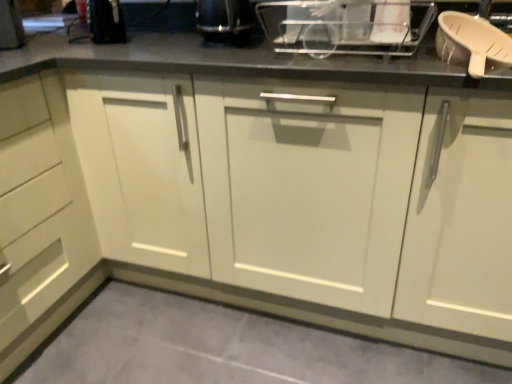
Question: Can you confirm if black plastic kettle at upper center, acting as the 1th appliance starting from the left, is bigger than gray tile floor at lower center?

Choices:
 (A) yes
 (B) no

Answer: (B)

Question: Does black plastic kettle at upper center, acting as the 1th appliance starting from the left, have a lesser height compared to gray tile floor at lower center?

Choices:
 (A) no
 (B) yes

Answer: (A)

Question: Is black plastic kettle at upper center, which appears as the 2th appliance when viewed from the right, with gray tile floor at lower center?

Choices:
 (A) no
 (B) yes

Answer: (A)

Question: Is the position of black plastic kettle at upper center, acting as the 1th appliance starting from the left, less distant than that of gray tile floor at lower center?

Choices:
 (A) yes
 (B) no

Answer: (B)

Question: Is black plastic kettle at upper center, acting as the 1th appliance starting from the left, surrounding gray tile floor at lower center?

Choices:
 (A) yes
 (B) no

Answer: (B)

Question: Considering the positions of gray tile floor at lower center and black plastic kettle at upper center, acting as the 1th appliance starting from the left, in the image, is gray tile floor at lower center wider or thinner than black plastic kettle at upper center, acting as the 1th appliance starting from the left,?

Choices:
 (A) thin
 (B) wide

Answer: (B)

Question: From the image's perspective, is gray tile floor at lower center positioned above or below black plastic kettle at upper center, acting as the 1th appliance starting from the left?

Choices:
 (A) below
 (B) above

Answer: (A)

Question: From a real-world perspective, is gray tile floor at lower center physically located above or below black plastic kettle at upper center, which appears as the 2th appliance when viewed from the right?

Choices:
 (A) above
 (B) below

Answer: (B)

Question: Relative to black plastic kettle at upper center, acting as the 1th appliance starting from the left, is gray tile floor at lower center in front or behind?

Choices:
 (A) front
 (B) behind

Answer: (A)

Question: Looking at their shapes, would you say white plastic dish rack at upper center, the second appliance viewed from the left, is wider or thinner than black plastic kettle at upper center, which appears as the 2th appliance when viewed from the right?

Choices:
 (A) wide
 (B) thin

Answer: (A)

Question: Based on their sizes in the image, would you say white plastic dish rack at upper center, which appears as the first appliance when viewed from the right, is bigger or smaller than black plastic kettle at upper center, acting as the 1th appliance starting from the left?

Choices:
 (A) big
 (B) small

Answer: (B)

Question: From a real-world perspective, is white plastic dish rack at upper center, which appears as the first appliance when viewed from the right, physically located above or below black plastic kettle at upper center, acting as the 1th appliance starting from the left?

Choices:
 (A) below
 (B) above

Answer: (B)

Question: Considering the relative positions of white plastic dish rack at upper center, which appears as the first appliance when viewed from the right, and black plastic kettle at upper center, acting as the 1th appliance starting from the left, in the image provided, is white plastic dish rack at upper center, which appears as the first appliance when viewed from the right, to the left or to the right of black plastic kettle at upper center, acting as the 1th appliance starting from the left,?

Choices:
 (A) left
 (B) right

Answer: (B)

Question: Which is correct: black plastic kettle at upper center, acting as the 1th appliance starting from the left, is inside white plastic dish rack at upper center, the second appliance viewed from the left, or outside of it?

Choices:
 (A) outside
 (B) inside

Answer: (A)

Question: Considering their positions, is black plastic kettle at upper center, acting as the 1th appliance starting from the left, located in front of or behind white plastic dish rack at upper center, which appears as the first appliance when viewed from the right?

Choices:
 (A) front
 (B) behind

Answer: (B)